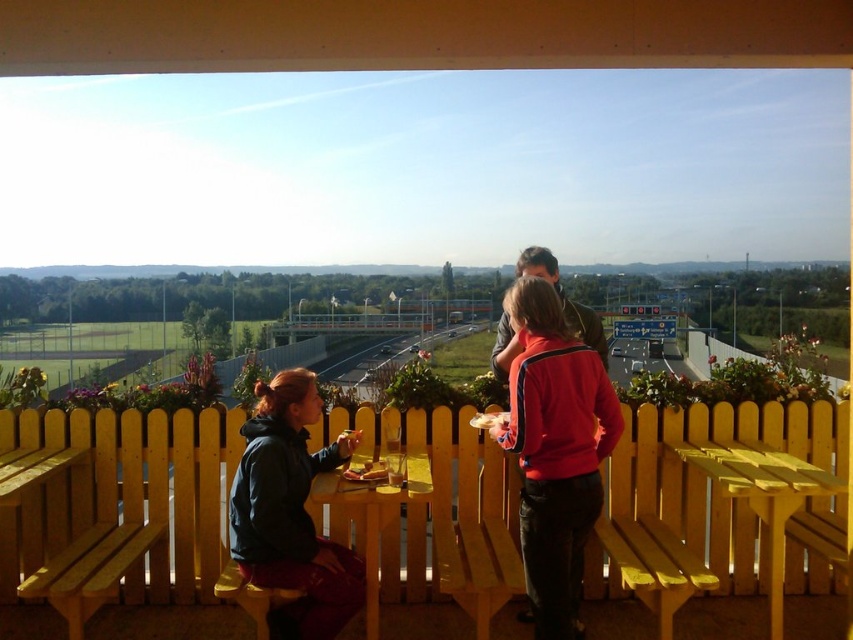
Consider the image. You are sitting on the yellow wood bench at lower right and want to move to the yellow wood bench at lower left. Which direction should you go?

The yellow wood bench at lower left is positioned on the left side of yellow wood bench at lower right, so you should move to the left to reach it.

You are standing on the balcony and want to place a small potted plant between the two points, point 1 at (566, 612) and point 2 at (699, 564). Which point should the plant be closer to in order to be nearer to you?

The plant should be closer to point 1 at (566, 612) because it is already closer to the viewer than point 2 at (699, 564).